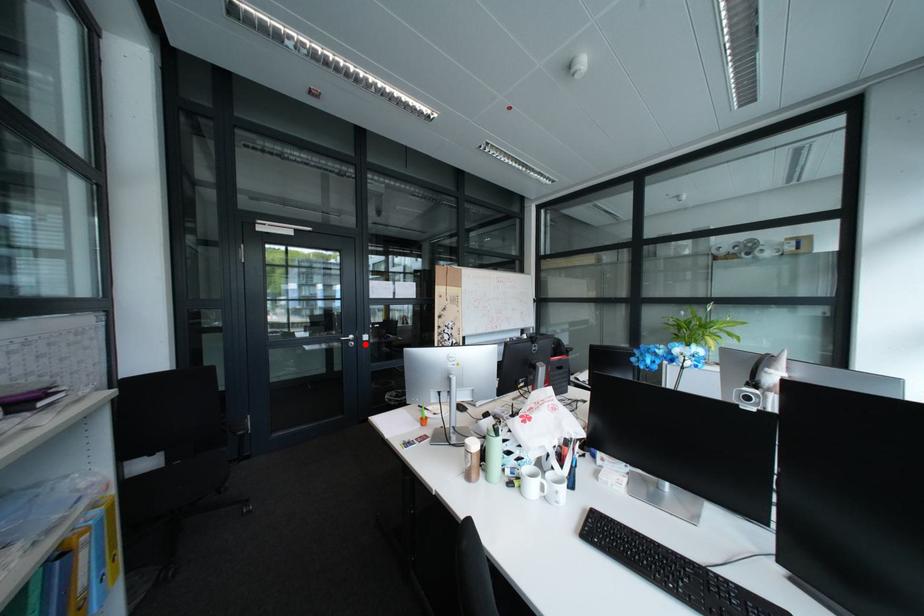
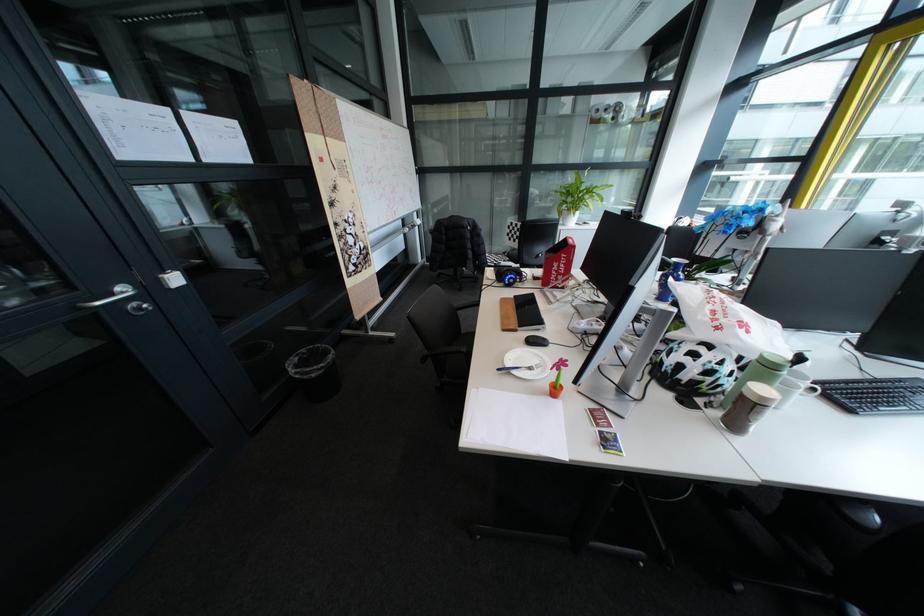
Find the pixel in the second image that matches the highlighted location in the first image.

(152, 309)